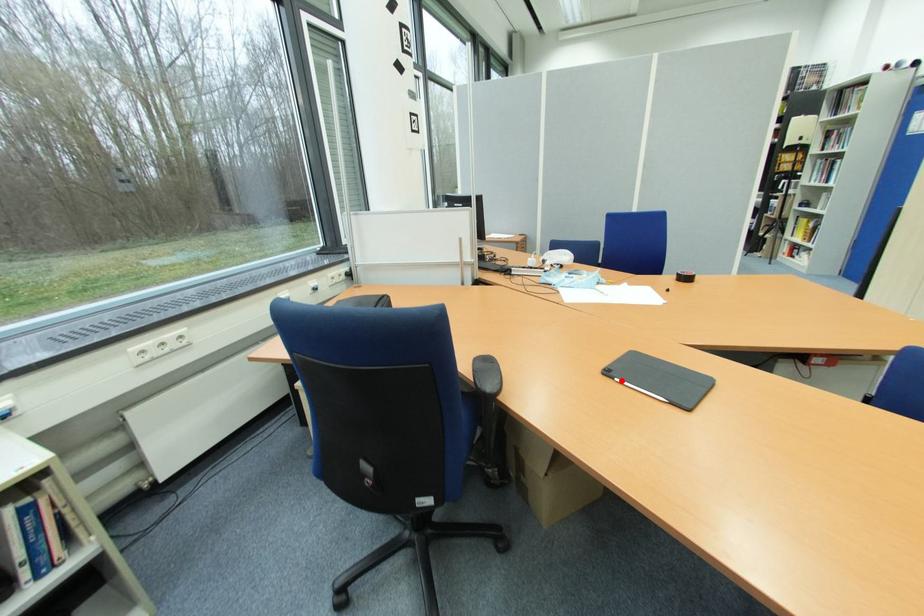
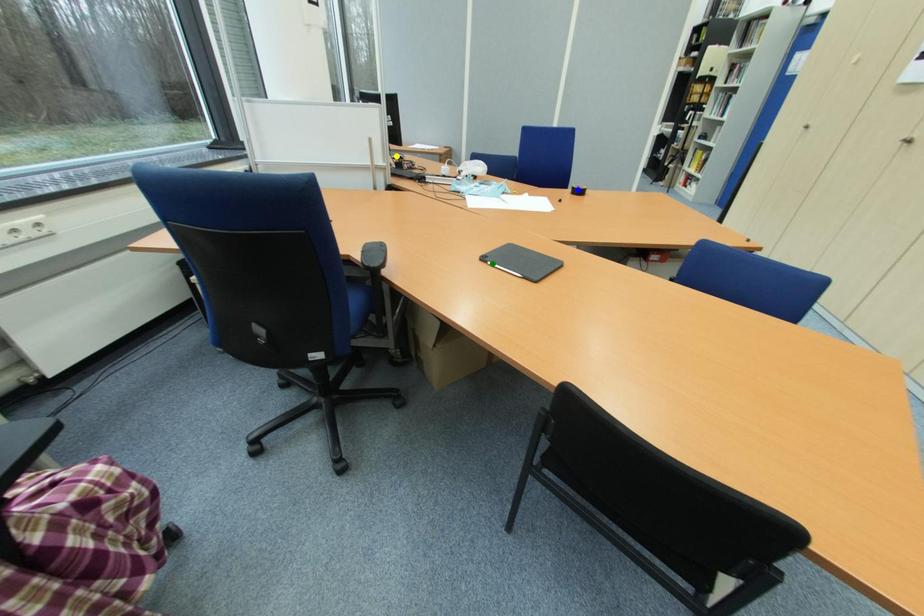
Question: I am providing you with two images of the same scene from different viewpoints. A red point is marked on the first image. You are given multiple points on the second image. Which point in image 2 is actually the same real-world point as the red point in image 1?

Choices:
 (A) blue point
 (B) yellow point
 (C) green point

Answer: (C)